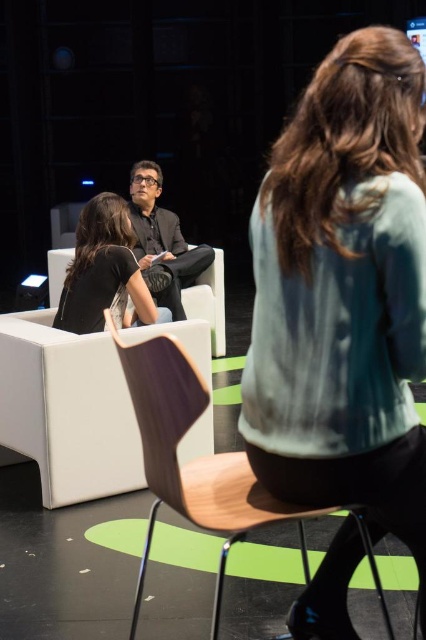
Who is shorter, light blue sweater at center or white leather armchair at left?

With less height is white leather armchair at left.

Is the position of light blue sweater at center more distant than that of white leather armchair at left?

That is False.

Who is more distant from viewer, (x=259, y=225) or (x=40, y=410)?

Positioned behind is point (x=40, y=410).

Image resolution: width=426 pixels, height=640 pixels. In order to click on light blue sweater at center in this screenshot , I will do `click(344, 294)`.

The image size is (426, 640). What do you see at coordinates (66, 410) in the screenshot? I see `white leather armchair at left` at bounding box center [66, 410].

Is point (46, 316) behind point (129, 268)?

That is True.

I want to click on white leather armchair at left, so click(x=66, y=410).

Which is behind, point (275, 500) or point (175, 301)?

Point (175, 301)

Between wooden chair at center and matte black shirt at center, which one is positioned lower?

Positioned lower is wooden chair at center.

The image size is (426, 640). Find the location of `wooden chair at center`. wooden chair at center is located at coordinates (203, 465).